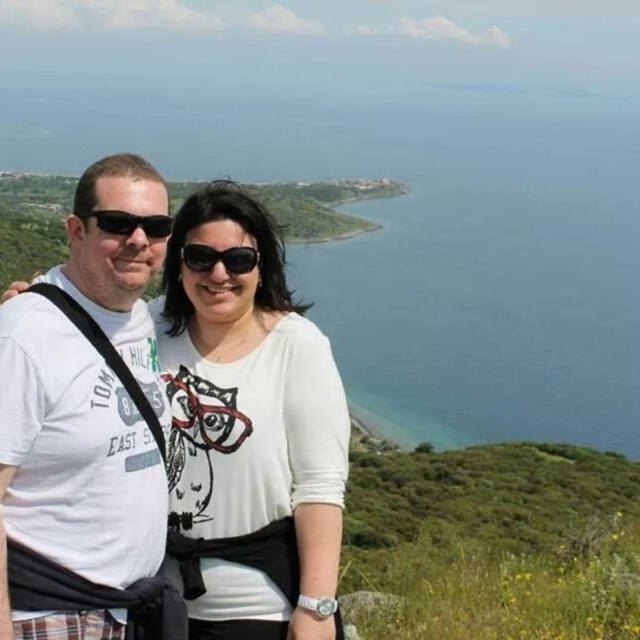
Question: Can you confirm if white matte shirt at center is positioned to the left of white cotton t-shirt at left?

Choices:
 (A) yes
 (B) no

Answer: (B)

Question: Which is farther from the black plastic sunglasses at left?

Choices:
 (A) blue water at center
 (B) white cotton t-shirt at left
 (C) black plastic sunglasses at center
 (D) white matte shirt at center

Answer: (A)

Question: Which is nearer to the blue water at center?

Choices:
 (A) white cotton t-shirt at left
 (B) black plastic sunglasses at left

Answer: (A)

Question: Does blue water at center appear on the right side of black plastic sunglasses at center?

Choices:
 (A) no
 (B) yes

Answer: (B)

Question: Estimate the real-world distances between objects in this image. Which object is closer to the blue water at center?

Choices:
 (A) black plastic sunglasses at left
 (B) white cotton t-shirt at left
 (C) white matte shirt at center

Answer: (C)

Question: Can you confirm if white cotton t-shirt at left is bigger than black plastic sunglasses at center?

Choices:
 (A) no
 (B) yes

Answer: (B)